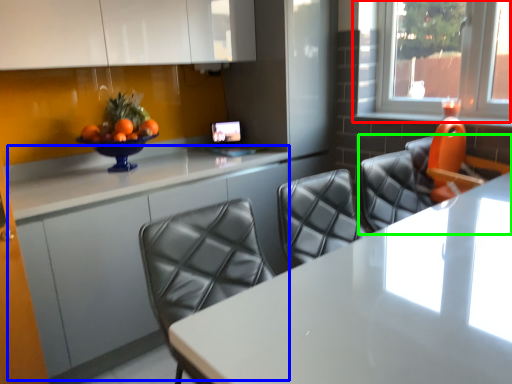
Question: Considering the real-world distances, which object is farthest from window (highlighted by a red box)? counter (highlighted by a blue box) or chair (highlighted by a green box)?

Choices:
 (A) counter
 (B) chair

Answer: (A)